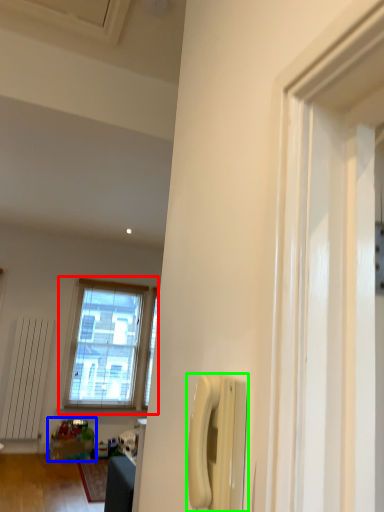
Question: Considering the real-world distances, which object is farthest from window (highlighted by a red box)? toy (highlighted by a blue box) or corded phone (highlighted by a green box)?

Choices:
 (A) toy
 (B) corded phone

Answer: (B)